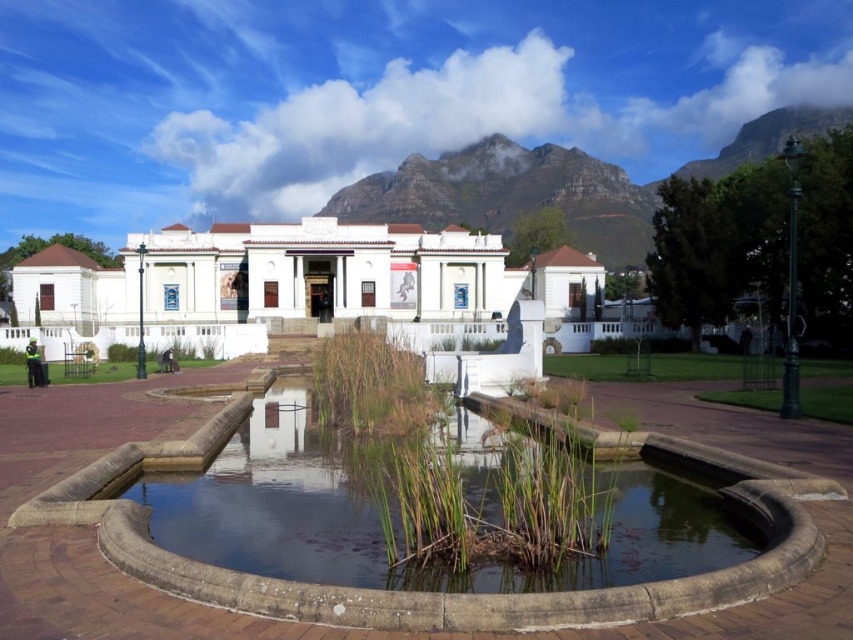
Between green concrete pond at center and white smooth building at center, which one appears on the left side from the viewer's perspective?

Positioned to the left is white smooth building at center.

What do you see at coordinates (379, 522) in the screenshot?
I see `green concrete pond at center` at bounding box center [379, 522].

Which is in front, point (424, 580) or point (242, 273)?

Point (424, 580) is more forward.

This screenshot has width=853, height=640. Find the location of `green concrete pond at center`. green concrete pond at center is located at coordinates (379, 522).

Where is `white smooth building at center`? The height and width of the screenshot is (640, 853). white smooth building at center is located at coordinates (310, 278).

Who is taller, white smooth building at center or rugged stone mountain at upper center?

rugged stone mountain at upper center

Between point (373, 259) and point (515, 179), which one is positioned behind?

The point (515, 179) is more distant.

Locate an element on the screen. white smooth building at center is located at coordinates (310, 278).

How distant is green concrete pond at center from rugged stone mountain at upper center?

128.20 meters

Image resolution: width=853 pixels, height=640 pixels. What do you see at coordinates (379, 522) in the screenshot?
I see `green concrete pond at center` at bounding box center [379, 522].

The width and height of the screenshot is (853, 640). In order to click on green concrete pond at center in this screenshot , I will do `click(379, 522)`.

I want to click on green concrete pond at center, so click(379, 522).